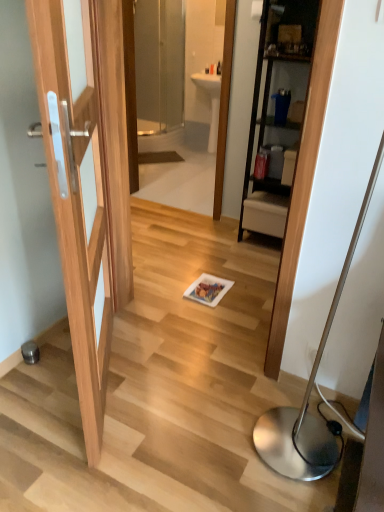
This screenshot has width=384, height=512. Describe the element at coordinates (191, 120) in the screenshot. I see `transparent glass mirror at upper center` at that location.

Find the location of a particular element. The height and width of the screenshot is (512, 384). transparent glass screen door at upper center is located at coordinates (159, 64).

Locate an element on the screen. This screenshot has width=384, height=512. silver metallic floor lamp at lower right is located at coordinates (309, 395).

Describe the element at coordinates (309, 395) in the screenshot. I see `silver metallic floor lamp at lower right` at that location.

What do you see at coordinates (211, 101) in the screenshot? This screenshot has height=512, width=384. I see `white glossy sink at center` at bounding box center [211, 101].

The height and width of the screenshot is (512, 384). What are the coordinates of `transparent glass mirror at upper center` in the screenshot? It's located at (191, 120).

Which of these two, silver metallic floor lamp at lower right or transparent glass mirror at upper center, is thinner?

transparent glass mirror at upper center.

Is silver metallic floor lamp at lower right facing towards transparent glass mirror at upper center?

No, silver metallic floor lamp at lower right is not facing towards transparent glass mirror at upper center.

Considering their positions, is silver metallic floor lamp at lower right located in front of or behind transparent glass mirror at upper center?

silver metallic floor lamp at lower right is in front of transparent glass mirror at upper center.

From the image's perspective, is silver metallic floor lamp at lower right above white glossy sink at center?

No, from the image's perspective, silver metallic floor lamp at lower right is not over white glossy sink at center.

Is silver metallic floor lamp at lower right closer to camera compared to white glossy sink at center?

→ Yes, the depth of silver metallic floor lamp at lower right is less than that of white glossy sink at center.

Is silver metallic floor lamp at lower right aimed at white glossy sink at center?

No.

How much distance is there between silver metallic floor lamp at lower right and white glossy sink at center?

They are 11.14 feet apart.

Could you tell me if transparent glass mirror at upper center is turned towards silver metallic floor lamp at lower right?

No, transparent glass mirror at upper center is not turned towards silver metallic floor lamp at lower right.

Considering the points (197, 205) and (329, 330), which point is behind, point (197, 205) or point (329, 330)?

Point (197, 205)

Considering the sizes of transparent glass mirror at upper center and silver metallic floor lamp at lower right in the image, is transparent glass mirror at upper center taller or shorter than silver metallic floor lamp at lower right?

Clearly, transparent glass mirror at upper center is taller compared to silver metallic floor lamp at lower right.

Considering the relative sizes of transparent glass mirror at upper center and silver metallic floor lamp at lower right in the image provided, is transparent glass mirror at upper center bigger than silver metallic floor lamp at lower right?

No.

Is transparent glass screen door at upper center spatially inside transparent glass mirror at upper center, or outside of it?

transparent glass screen door at upper center is not inside transparent glass mirror at upper center, it's outside.

In terms of height, does transparent glass screen door at upper center look taller or shorter compared to transparent glass mirror at upper center?

Considering their sizes, transparent glass screen door at upper center has less height than transparent glass mirror at upper center.

This screenshot has height=512, width=384. I want to click on mirror on the right of the transparent glass screen door at upper center, so click(191, 120).

How far apart are transparent glass screen door at upper center and transparent glass mirror at upper center?

They are 18.97 inches apart.

From the image's perspective, is transparent glass screen door at upper center above or below silver metallic floor lamp at lower right?

Clearly, from the image's perspective, transparent glass screen door at upper center is above silver metallic floor lamp at lower right.

Which is farther, (x=173, y=115) or (x=319, y=475)?

Positioned behind is point (x=173, y=115).

Would you say transparent glass screen door at upper center contains silver metallic floor lamp at lower right?

That's incorrect, silver metallic floor lamp at lower right is not inside transparent glass screen door at upper center.

How different are the orientations of transparent glass screen door at upper center and silver metallic floor lamp at lower right in degrees?

1.67 degrees.

From a real-world perspective, is silver metallic floor lamp at lower right physically above transparent glass screen door at upper center?

No, from a real-world perspective, silver metallic floor lamp at lower right is not over transparent glass screen door at upper center

Between silver metallic floor lamp at lower right and transparent glass screen door at upper center, which one has smaller width?

With smaller width is silver metallic floor lamp at lower right.

Can you tell me how much silver metallic floor lamp at lower right and transparent glass screen door at upper center differ in facing direction?

The angle between the facing direction of silver metallic floor lamp at lower right and the facing direction of transparent glass screen door at upper center is 1.67 degrees.

Based on the photo, is silver metallic floor lamp at lower right turned away from transparent glass screen door at upper center?

No, silver metallic floor lamp at lower right is not facing away from transparent glass screen door at upper center.

From the image's perspective, is white glossy sink at center located above or below transparent glass mirror at upper center?

white glossy sink at center is situated higher than transparent glass mirror at upper center in the image.

Which is closer, (195, 83) or (225, 18)?

The point (225, 18) is closer.

Considering the sizes of white glossy sink at center and transparent glass mirror at upper center in the image, is white glossy sink at center bigger or smaller than transparent glass mirror at upper center?

Considering their sizes, white glossy sink at center takes up more space than transparent glass mirror at upper center.

In the scene shown: Can you confirm if white glossy sink at center is thinner than transparent glass mirror at upper center?

No.

The height and width of the screenshot is (512, 384). In order to click on mirror that is on the left side of silver metallic floor lamp at lower right in this screenshot , I will do `click(191, 120)`.

Where is `sink below the silver metallic floor lamp at lower right (from a real-world perspective)`? The width and height of the screenshot is (384, 512). sink below the silver metallic floor lamp at lower right (from a real-world perspective) is located at coordinates (211, 101).

When comparing their distances from transparent glass mirror at upper center, does white glossy sink at center or silver metallic floor lamp at lower right seem closer?

The object closer to transparent glass mirror at upper center is white glossy sink at center.

From the image, which object appears to be farther from silver metallic floor lamp at lower right, white glossy sink at center or transparent glass mirror at upper center?

The object further to silver metallic floor lamp at lower right is white glossy sink at center.

Looking at the image, which one is located further to transparent glass mirror at upper center, silver metallic floor lamp at lower right or white glossy sink at center?

Based on the image, silver metallic floor lamp at lower right appears to be further to transparent glass mirror at upper center.

When comparing their distances from white glossy sink at center, does transparent glass screen door at upper center or transparent glass mirror at upper center seem further?

Based on the image, transparent glass screen door at upper center appears to be further to white glossy sink at center.

Looking at the image, which one is located closer to transparent glass screen door at upper center, white glossy sink at center or transparent glass mirror at upper center?

Based on the image, transparent glass mirror at upper center appears to be nearer to transparent glass screen door at upper center.

Based on their spatial positions, is transparent glass mirror at upper center or transparent glass screen door at upper center further from silver metallic floor lamp at lower right?

transparent glass screen door at upper center is positioned further to the anchor silver metallic floor lamp at lower right.

Considering their positions, is transparent glass screen door at upper center positioned further to silver metallic floor lamp at lower right than white glossy sink at center?

Based on the image, transparent glass screen door at upper center appears to be further to silver metallic floor lamp at lower right.

Looking at the image, which one is located closer to white glossy sink at center, silver metallic floor lamp at lower right or transparent glass screen door at upper center?

The object closer to white glossy sink at center is transparent glass screen door at upper center.

I want to click on screen door located between transparent glass mirror at upper center and white glossy sink at center in the depth direction, so click(x=159, y=64).

The width and height of the screenshot is (384, 512). I want to click on mirror between silver metallic floor lamp at lower right and transparent glass screen door at upper center along the z-axis, so click(x=191, y=120).

In order to click on screen door between silver metallic floor lamp at lower right and white glossy sink at center in the front-back direction in this screenshot , I will do `click(159, 64)`.

At what (x,y) coordinates should I click in order to perform the action: click on mirror between silver metallic floor lamp at lower right and white glossy sink at center from front to back. Please return your answer as a coordinate pair (x, y). The image size is (384, 512). Looking at the image, I should click on (191, 120).